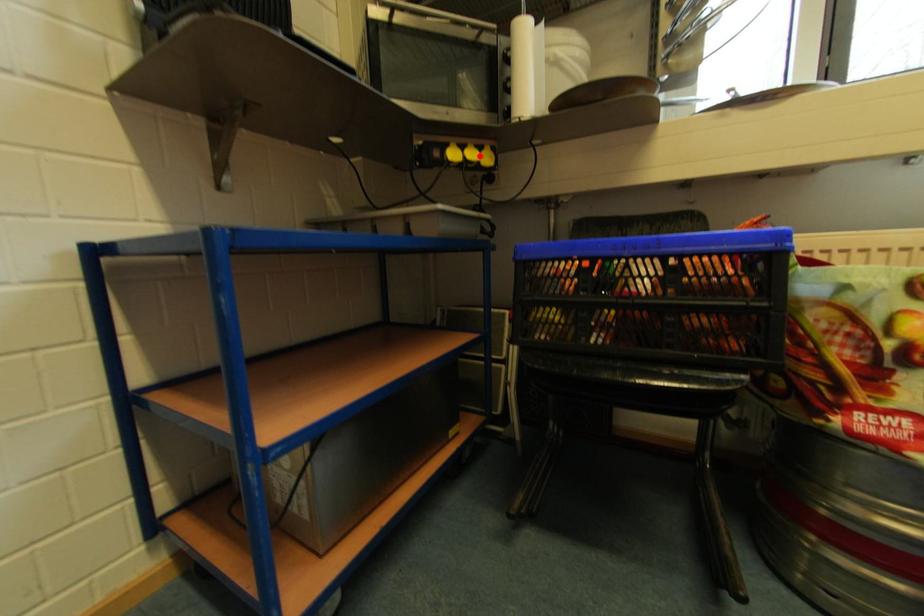
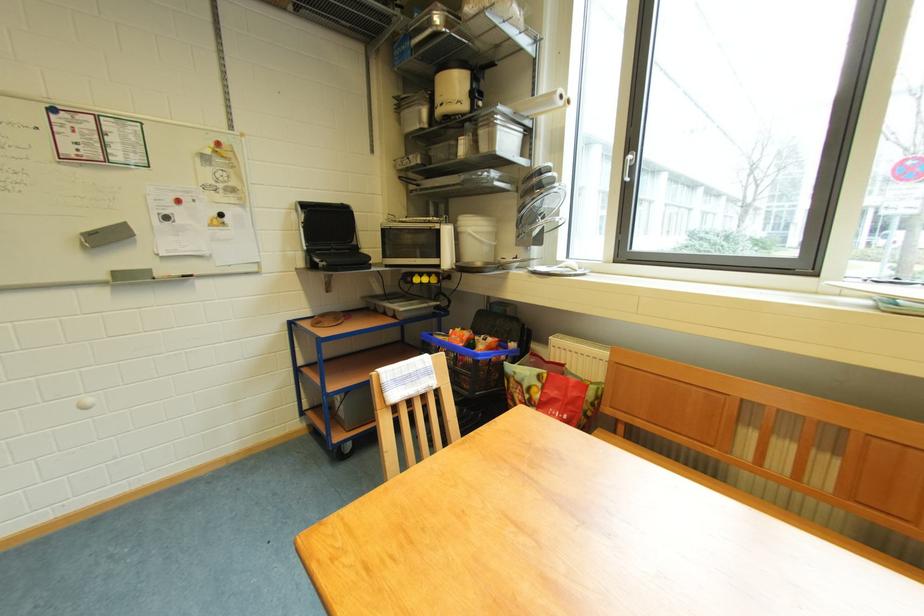
The point at the highlighted location is marked in the first image. Where is the corresponding point in the second image?

(432, 283)